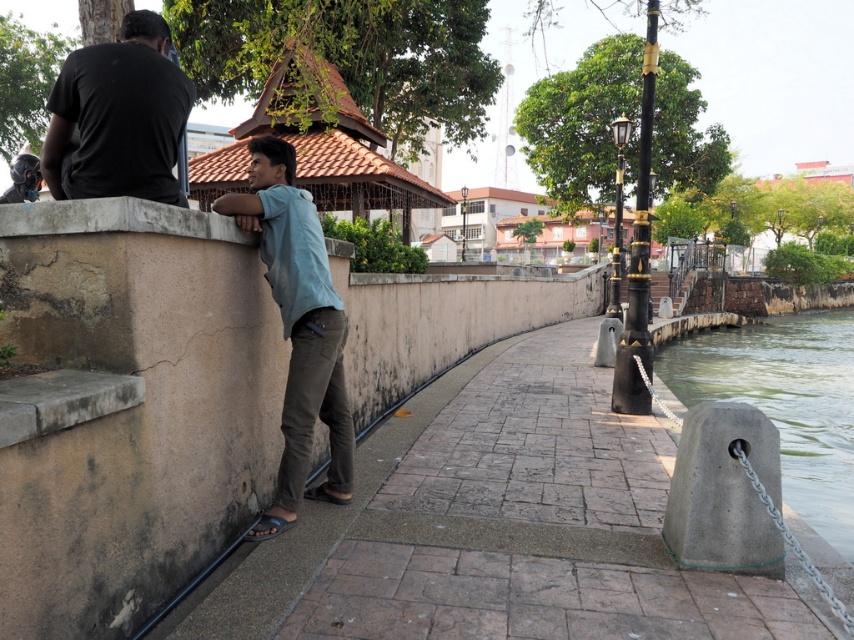
You are a photographer trying to capture both the light blue fabric shirt at center and the black matte shirt at upper left in a single frame. Based on their heights, which one should you position closer to the camera to ensure both are fully visible in the photo?

Since the light blue fabric shirt at center is much taller than the black matte shirt at upper left, you should position the black matte shirt at upper left closer to the camera to ensure both are fully visible in the photo.

You are standing on the pathway and want to take a photo of both the gray concrete bollard at lower right and the black matte shirt at upper left in the same frame. Which object should be closer to the camera to ensure both are visible?

The black matte shirt at upper left is behind the gray concrete bollard at lower right, so to include both in the frame, the gray concrete bollard at lower right should be closer to the camera to avoid blocking the black matte shirt at upper left.